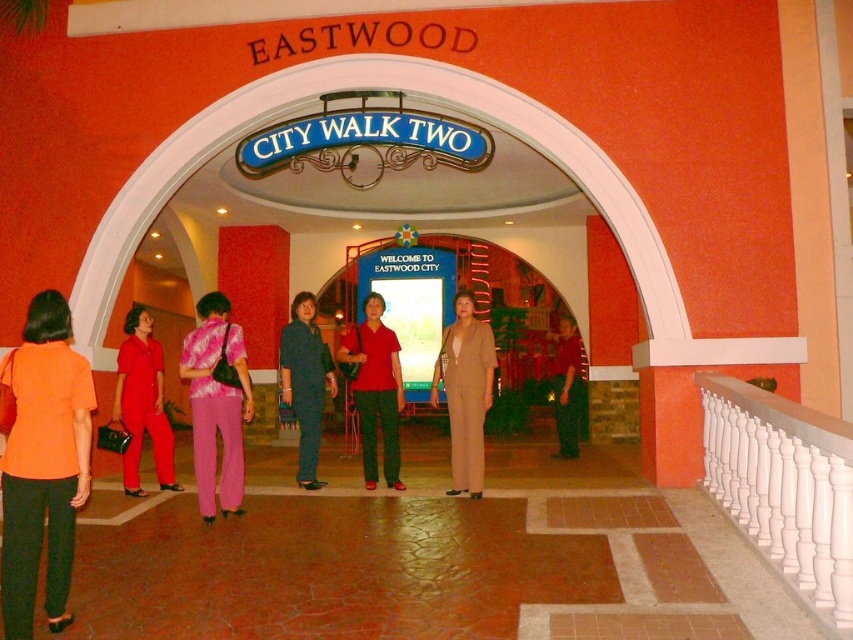
You are a security guard at Eastwood City Walk Two. You notice two people entering through the arched doorway. One is wearing a matte red jumpsuit at left and the other a dark blue shirt at center. Based on the scene description, which of the two individuals is shorter?

The matte red jumpsuit at left is shorter than the dark blue shirt at center because the description states that the matte red jumpsuit at left is not as tall as the dark blue shirt at center.

You are standing at the entrance of Eastwood City Walk Two and see two points marked on the floor. The first point is at coordinates point (138, 438), and the second point is at point (335, 385). If you want to move from the first point to the second point, which direction should you walk relative to the entrance?

You should walk towards the entrance because point (138, 438) is in front of point (335, 385). Since you are at the entrance, moving towards the entrance would take you from the first point to the second point.